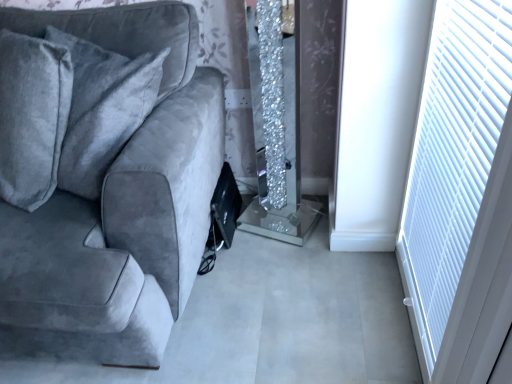
Locate an element on the screen. This screenshot has width=512, height=384. white textured blind at right is located at coordinates (455, 156).

This screenshot has height=384, width=512. Describe the element at coordinates (455, 156) in the screenshot. I see `white textured blind at right` at that location.

The image size is (512, 384). What do you see at coordinates (119, 207) in the screenshot?
I see `velvet gray couch at left` at bounding box center [119, 207].

Identify the location of velvet gray couch at left. This screenshot has width=512, height=384. (119, 207).

Identify the location of white textured blind at right. Image resolution: width=512 pixels, height=384 pixels. (455, 156).

Visually, is velvet gray couch at left positioned to the left or to the right of white textured blind at right?

From the image, it's evident that velvet gray couch at left is to the left of white textured blind at right.

Which object is further away from the camera, velvet gray couch at left or white textured blind at right?

Positioned behind is velvet gray couch at left.

Is point (114, 335) farther from viewer compared to point (407, 272)?

No.

From the image's perspective, is velvet gray couch at left beneath white textured blind at right?

Actually, velvet gray couch at left appears above white textured blind at right in the image.

From a real-world perspective, which object rests below the other?

From a 3D spatial view, velvet gray couch at left is below.

Does velvet gray couch at left have a greater width compared to white textured blind at right?

Yes, velvet gray couch at left is wider than white textured blind at right.

Considering the sizes of objects velvet gray couch at left and white textured blind at right in the image provided, who is shorter, velvet gray couch at left or white textured blind at right?

white textured blind at right is shorter.

Who is smaller, velvet gray couch at left or white textured blind at right?

white textured blind at right is smaller.

Is white textured blind at right completely or partially inside velvet gray couch at left?

No, white textured blind at right is not surrounded by velvet gray couch at left.

Is velvet gray couch at left far away from white textured blind at right?

No.

Is velvet gray couch at left oriented towards white textured blind at right?

No, velvet gray couch at left is not oriented towards white textured blind at right.

The image size is (512, 384). I want to click on studio couch above the white textured blind at right (from the image's perspective), so click(119, 207).

Based on their positions, is white textured blind at right located to the left or right of velvet gray couch at left?

white textured blind at right is positioned on velvet gray couch at left's right side.

Is the depth of white textured blind at right greater than that of velvet gray couch at left?

No.

Between point (478, 32) and point (202, 154), which one is positioned behind?

The point (202, 154) is farther.

From the image's perspective, would you say white textured blind at right is shown under velvet gray couch at left?

Yes, from the image's perspective, white textured blind at right is beneath velvet gray couch at left.

From a real-world perspective, which object rests below the other?

In real-world perspective, velvet gray couch at left is lower.

Is white textured blind at right wider than velvet gray couch at left?

No.

Which of these two, white textured blind at right or velvet gray couch at left, stands shorter?

Standing shorter between the two is white textured blind at right.

Does white textured blind at right have a larger size compared to velvet gray couch at left?

Actually, white textured blind at right might be smaller than velvet gray couch at left.

Does white textured blind at right contain velvet gray couch at left?

That's incorrect, velvet gray couch at left is not inside white textured blind at right.

Is white textured blind at right placed right next to velvet gray couch at left?

No.

Is white textured blind at right facing away from velvet gray couch at left?

white textured blind at right is not turned away from velvet gray couch at left.

Can you tell me how much white textured blind at right and velvet gray couch at left differ in facing direction?

89 degrees separate the facing orientations of white textured blind at right and velvet gray couch at left.

Locate an element on the screen. The height and width of the screenshot is (384, 512). studio couch located underneath the white textured blind at right (from a real-world perspective) is located at coordinates (119, 207).

Where is `blind located in front of the velvet gray couch at left`? The width and height of the screenshot is (512, 384). blind located in front of the velvet gray couch at left is located at coordinates (455, 156).

Locate an element on the screen. studio couch below the white textured blind at right (from a real-world perspective) is located at coordinates (119, 207).